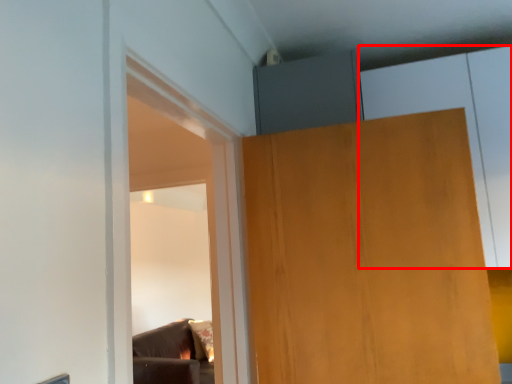
Question: From the image's perspective, where is cabinetry (annotated by the red box) located relative to door?

Choices:
 (A) above
 (B) below

Answer: (A)